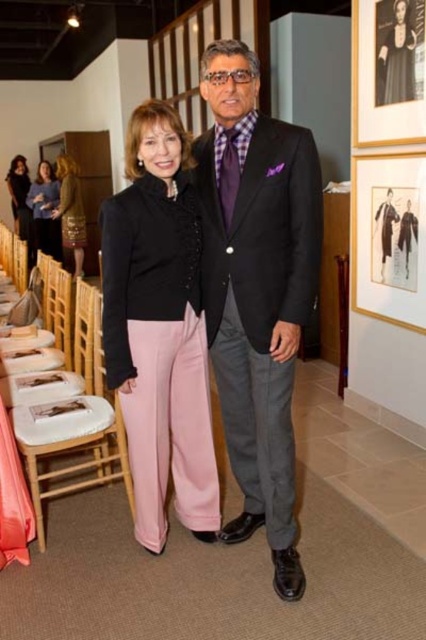
Looking at this image, is gold metallic dress at left taller than matte black dress at upper left?

Correct, gold metallic dress at left is much taller as matte black dress at upper left.

Does gold metallic dress at left appear under matte black dress at upper left?

Correct, gold metallic dress at left is located below matte black dress at upper left.

Is point (63, 157) positioned after point (51, 188)?

No, it is not.

At what (x,y) coordinates should I click in order to perform the action: click on gold metallic dress at left. Please return your answer as a coordinate pair (x, y). Looking at the image, I should click on (71, 211).

In the scene shown: Does matte black blazer at center appear over wooden chair at lower left?

Indeed, matte black blazer at center is positioned over wooden chair at lower left.

Describe the element at coordinates (158, 328) in the screenshot. I see `matte black blazer at center` at that location.

Which is behind, point (138, 278) or point (83, 404)?

Point (83, 404)

Identify the location of matte black blazer at center. coord(158,328).

Is matte black suit at center shorter than gold metallic dress at left?

No, matte black suit at center is not shorter than gold metallic dress at left.

Does matte black suit at center appear on the left side of gold metallic dress at left?

No, matte black suit at center is not to the left of gold metallic dress at left.

Where is `matte black suit at center`? This screenshot has width=426, height=640. matte black suit at center is located at coordinates (256, 289).

You are a GUI agent. You are given a task and a screenshot of the screen. Output one action in this format:
    pyautogui.click(x=<x>, y=<y>)
    Task: Click on the matte black suit at center
    This screenshot has height=640, width=426.
    Given the screenshot: What is the action you would take?
    pyautogui.click(x=256, y=289)